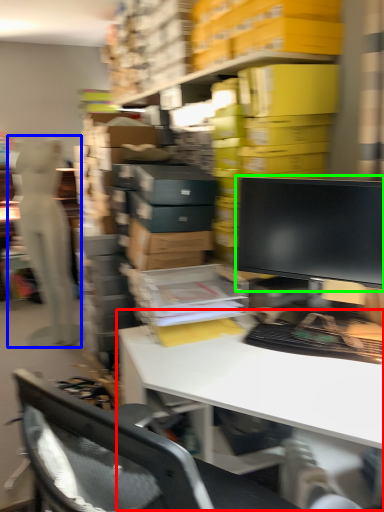
Question: Based on their relative distances, which object is nearer to desk (highlighted by a red box)? Choose from person (highlighted by a blue box) and computer monitor (highlighted by a green box).

Choices:
 (A) person
 (B) computer monitor

Answer: (B)